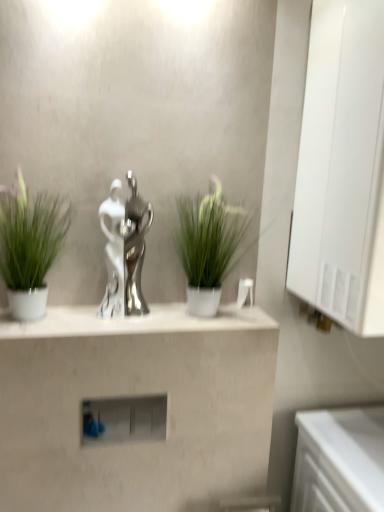
The height and width of the screenshot is (512, 384). I want to click on vacant space that's between green matte plant at left, which is counted as the 2th houseplant, starting from the right, and silver metallic trophy at center, so click(x=101, y=318).